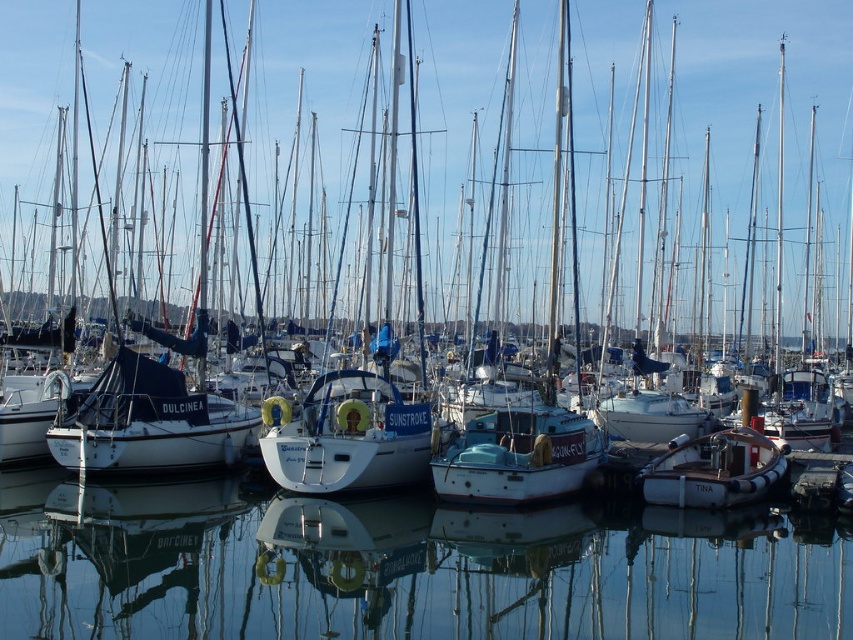
Question: Among these points, which one is nearest to the camera?

Choices:
 (A) (381, 460)
 (B) (65, 628)
 (C) (494, 502)

Answer: (B)

Question: Does white matte sailboat at center appear on the left side of wooden dinghy at center?

Choices:
 (A) yes
 (B) no

Answer: (A)

Question: Which object appears farthest from the camera in this image?

Choices:
 (A) white matte boat at center
 (B) white matte sailboat at center

Answer: (B)

Question: Can you confirm if transparent glass water at center is positioned below wooden dinghy at center?

Choices:
 (A) yes
 (B) no

Answer: (A)

Question: Which is nearer to the white matte sailboat at center?

Choices:
 (A) white glossy sailboat at center
 (B) wooden dinghy at center
 (C) white matte boat at center

Answer: (A)

Question: Does white glossy sailboat at center come behind wooden dinghy at center?

Choices:
 (A) no
 (B) yes

Answer: (B)